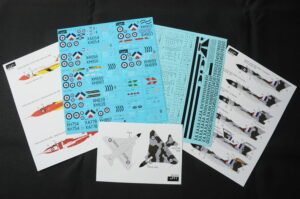
You are a GUI agent. You are given a task and a screenshot of the screen. Output one action in this format:
    pyautogui.click(x=<x>, y=<y>)
    Task: Click on the crease in fabric
    This screenshot has width=300, height=199.
    Given the screenshot: What is the action you would take?
    pyautogui.click(x=78, y=165)